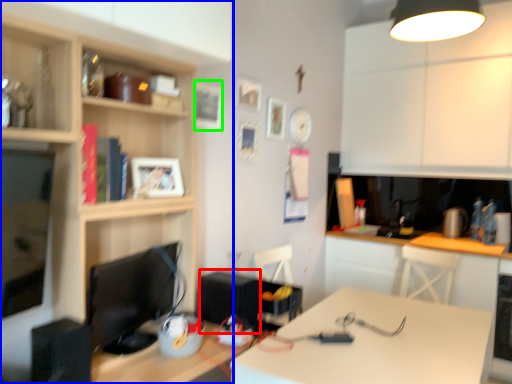
Question: Which object is the closest to the appliance (highlighted by a red box)? Choose among these: cabinetry (highlighted by a blue box) or picture frame (highlighted by a green box).

Choices:
 (A) cabinetry
 (B) picture frame

Answer: (A)